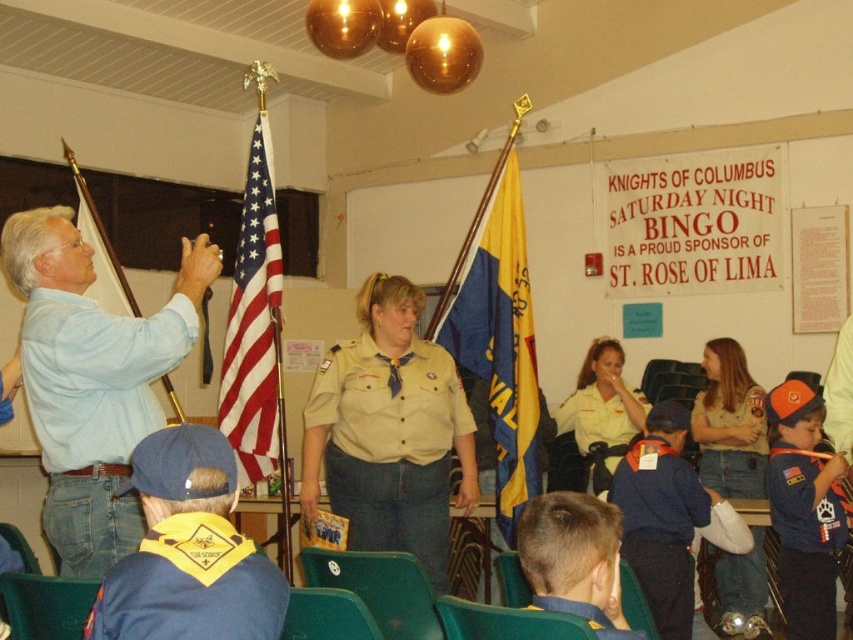
Which is below, light blue cotton shirt at left or yellow cloth neckerchief at lower left?

Positioned lower is yellow cloth neckerchief at lower left.

Is light blue cotton shirt at left to the left of yellow cloth neckerchief at lower left from the viewer's perspective?

Correct, you'll find light blue cotton shirt at left to the left of yellow cloth neckerchief at lower left.

Locate an element on the screen. The width and height of the screenshot is (853, 640). light blue cotton shirt at left is located at coordinates (94, 413).

Is yellow cloth neckerchief at lower left smaller than blue uniform at lower right?

Indeed, yellow cloth neckerchief at lower left has a smaller size compared to blue uniform at lower right.

Does point (231, 564) lie in front of point (822, 512)?

Yes, it is.

Is point (165, 628) behind point (799, 561)?

No, (165, 628) is closer to viewer.

The height and width of the screenshot is (640, 853). I want to click on yellow cloth neckerchief at lower left, so click(190, 586).

Does point (425, 506) come in front of point (804, 632)?

No.

Image resolution: width=853 pixels, height=640 pixels. Describe the element at coordinates (389, 445) in the screenshot. I see `tan uniform at center` at that location.

Where is `tan uniform at center`? tan uniform at center is located at coordinates (389, 445).